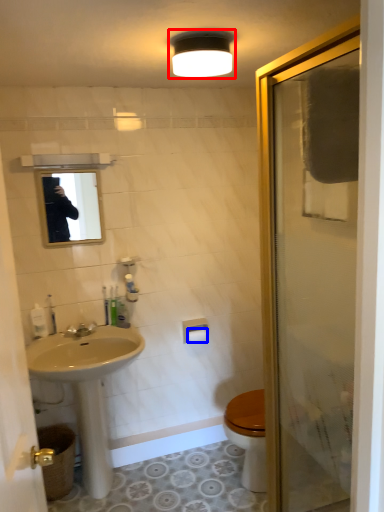
Question: Which of the following is the farthest to the observer, light fixture (highlighted by a red box) or toilet paper (highlighted by a blue box)?

Choices:
 (A) light fixture
 (B) toilet paper

Answer: (B)